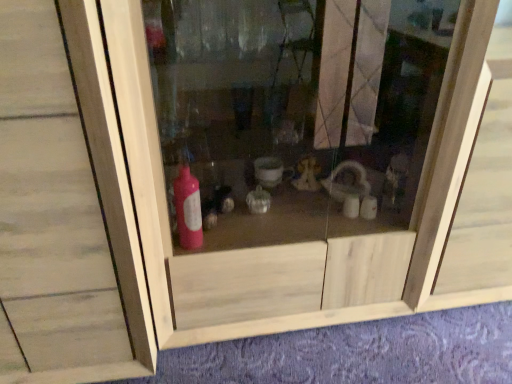
The height and width of the screenshot is (384, 512). What do you see at coordinates (65, 207) in the screenshot? I see `natural wood cabinet at left` at bounding box center [65, 207].

You are a GUI agent. You are given a task and a screenshot of the screen. Output one action in this format:
    pyautogui.click(x=<x>, y=<y>)
    Task: Click on the natural wood cabinet at left
    
    Given the screenshot: What is the action you would take?
    pyautogui.click(x=65, y=207)

Find the location of a particular element. The height and width of the screenshot is (384, 512). natural wood cabinet at left is located at coordinates (65, 207).